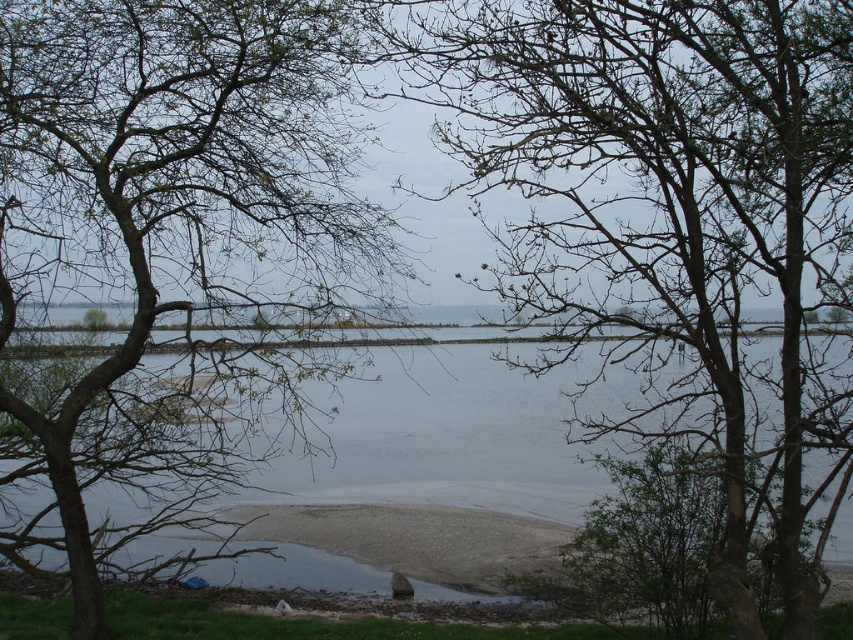
Question: Among these points, which one is nearest to the camera?

Choices:
 (A) (21, 296)
 (B) (393, 392)

Answer: (A)

Question: Does bare branches at left appear on the left side of clear water at center?

Choices:
 (A) yes
 (B) no

Answer: (A)

Question: Which point is closer to the camera?

Choices:
 (A) bare branches at center
 (B) bare branches at left

Answer: (A)

Question: Which is nearer to the bare branches at center?

Choices:
 (A) clear water at center
 (B) bare branches at left

Answer: (B)

Question: Is bare branches at center positioned before bare branches at left?

Choices:
 (A) no
 (B) yes

Answer: (B)

Question: Considering the relative positions of bare branches at left and clear water at center in the image provided, where is bare branches at left located with respect to clear water at center?

Choices:
 (A) above
 (B) below

Answer: (A)